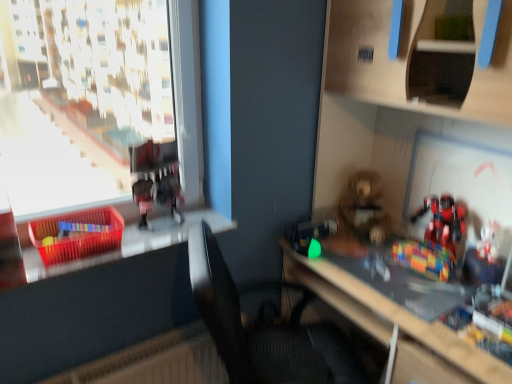
Find the location of a particular element. The image size is (512, 384). free space in front of metallic red robot at upper left, placed as the 1th toy when sorted from left to right is located at coordinates (155, 243).